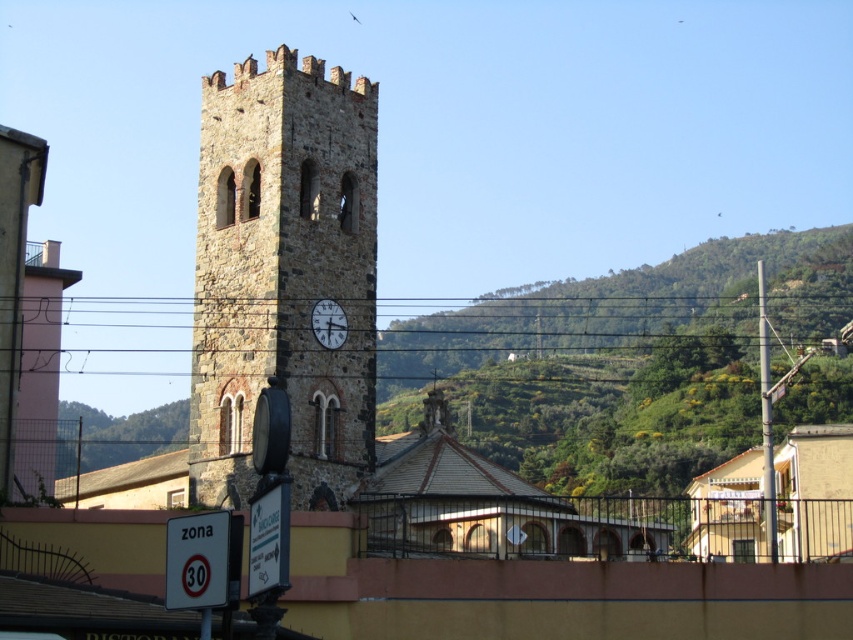
Consider the image. Is stone clock tower at center behind matte stone clock at center?

No, it is in front of matte stone clock at center.

Is stone clock tower at center taller than matte stone clock at center?

Correct, stone clock tower at center is much taller as matte stone clock at center.

Is point (300, 442) positioned in front of point (317, 336)?

Yes.

Identify the location of stone clock tower at center. Image resolution: width=853 pixels, height=640 pixels. (283, 275).